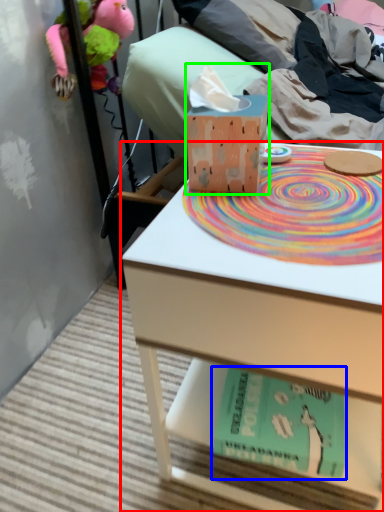
Question: Considering the real-world distances, which object is farthest from table (highlighted by a red box)? paperback book (highlighted by a blue box) or tissue (highlighted by a green box)?

Choices:
 (A) paperback book
 (B) tissue

Answer: (B)